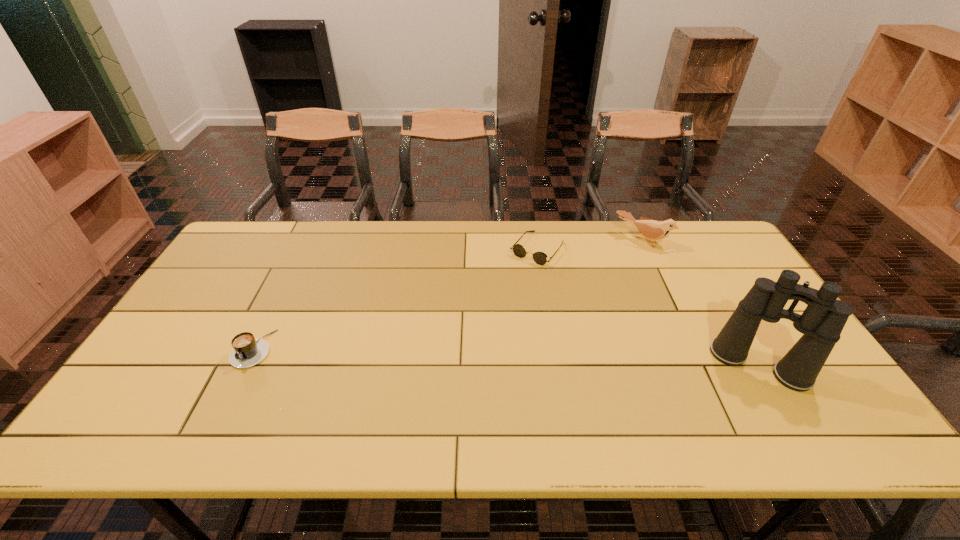
Where is `free space on the desktop that is between the cappuccino and the binoculars and is positioned on the front-facing side of the sunglasses`? The width and height of the screenshot is (960, 540). free space on the desktop that is between the cappuccino and the binoculars and is positioned on the front-facing side of the sunglasses is located at coordinates (449, 355).

The width and height of the screenshot is (960, 540). I want to click on free spot on the desktop that is between the cappuccino and the tallest object and is positioned at the beak of the bird, so click(560, 359).